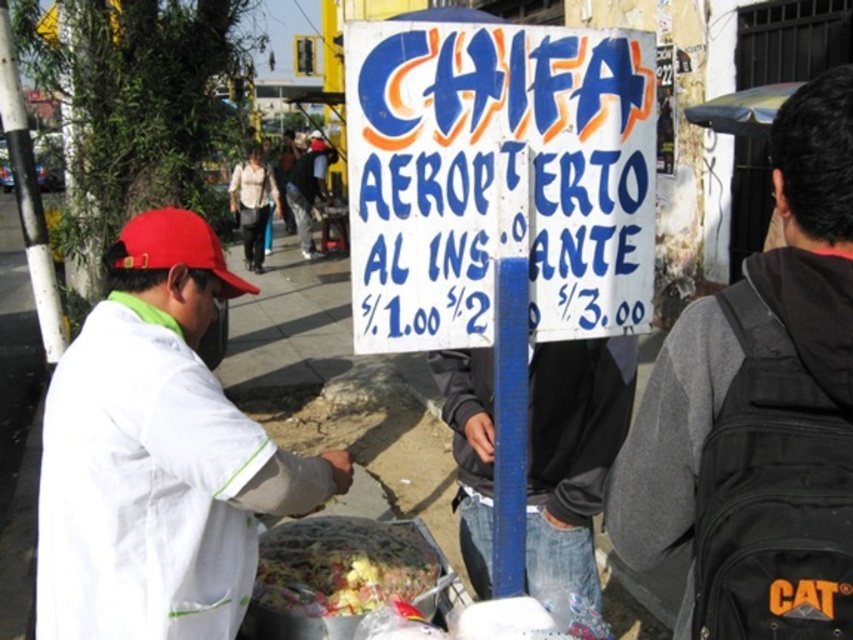
You are a customer at the CHIFA AEROPUERTO AL INSTANTE food stall. You want to grab the shiny plastic container at center without touching the matte red cap at left. Is this possible?

The shiny plastic container at center is positioned under the matte red cap at left, so you can grab the shiny plastic container at center without touching the matte red cap at left by reaching underneath it.

You are a traveler who just arrived at the airport and wants to buy a meal. You see the white cardboard sign at center and the shiny plastic container at center. Which object is wider?

The white cardboard sign at center is wider than the shiny plastic container at center.

You are a traveler who just arrived at the airport and wants to buy a meal from the vendor. You see the white fabric jacket at left and the shiny plastic container at center. Which object is higher up in the image?

The white fabric jacket at left is above the shiny plastic container at center, so the white fabric jacket at left is higher up in the image.